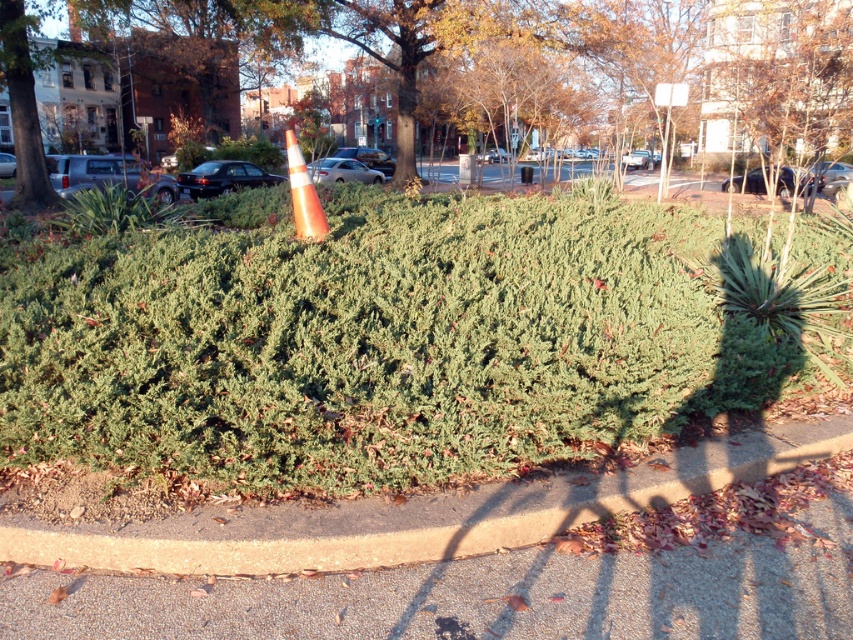
You are a gardener who needs to place a new decorative statue between the green leafy bush at center and the concrete curb at lower center. Based on their positions, which object should the statue be closer to?

The statue should be placed closer to the concrete curb at lower center because the green leafy bush at center is positioned on the right side of the concrete curb at lower center, meaning the curb is to the left of the bush. Therefore, placing the statue between them would require it to be closer to the curb if it is to the left of the bush.

From the picture: You are a delivery person trying to park your bike. You see the bright orange traffic cone near the center of the hedge and the concrete curb at lower center. Which one is closer to you?

The concrete curb at lower center is closer to you because they are 3.21 meters apart.

You are standing in the urban landscape and want to place a 10 feet long fence panel between you and the green leafy bush at center. Is there enough space to place it?

The distance between you and the green leafy bush at center is 50.65 feet. Since the fence panel is only 10 feet long, there is sufficient space to place it between you and the green leafy bush at center.